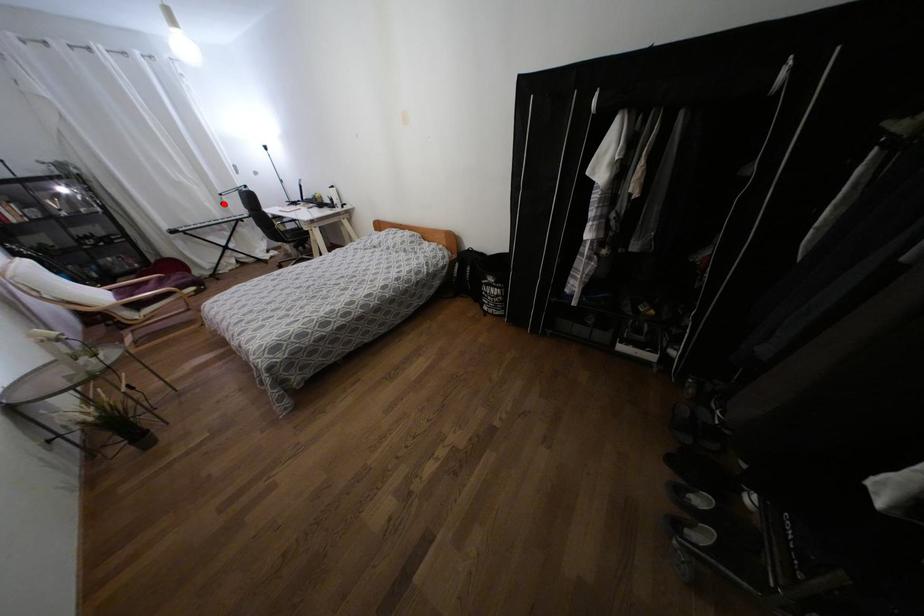
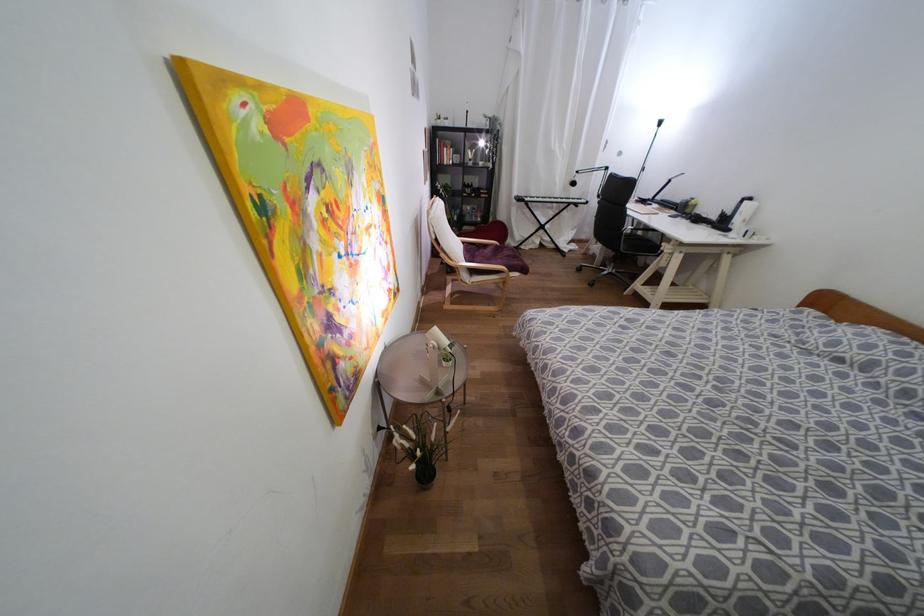
Question: I am providing you with two images of the same scene from different viewpoints. Given a red point in image1, look at the same physical point in image2. Is it:

Choices:
 (A) Closer to the viewpoint
 (B) Farther from the viewpoint

Answer: (A)